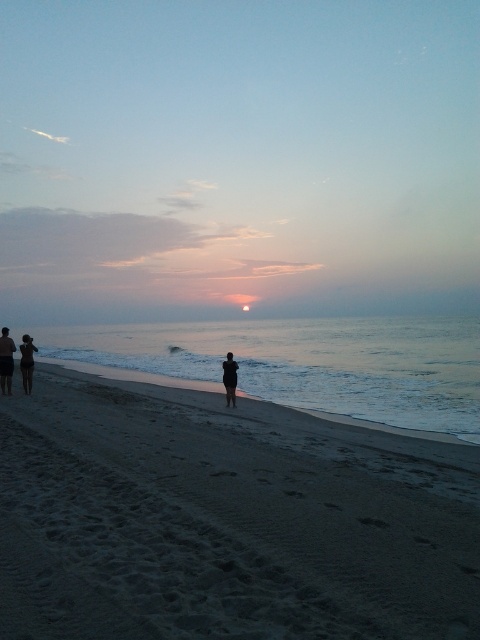
You are standing on the beach and notice the dark sand at lower left and the silhouette figure at lower left. Which one is closer to the horizon?

The silhouette figure at lower left is closer to the horizon because it has a greater height than the dark sand at lower left.

You are standing on the beach in the image and notice a specific point marked at coordinates [226,518]. What is the location of this point relative to the beach?

The dark sand at lower left is located at point [226,518], so the point is on the dark sand at lower left.